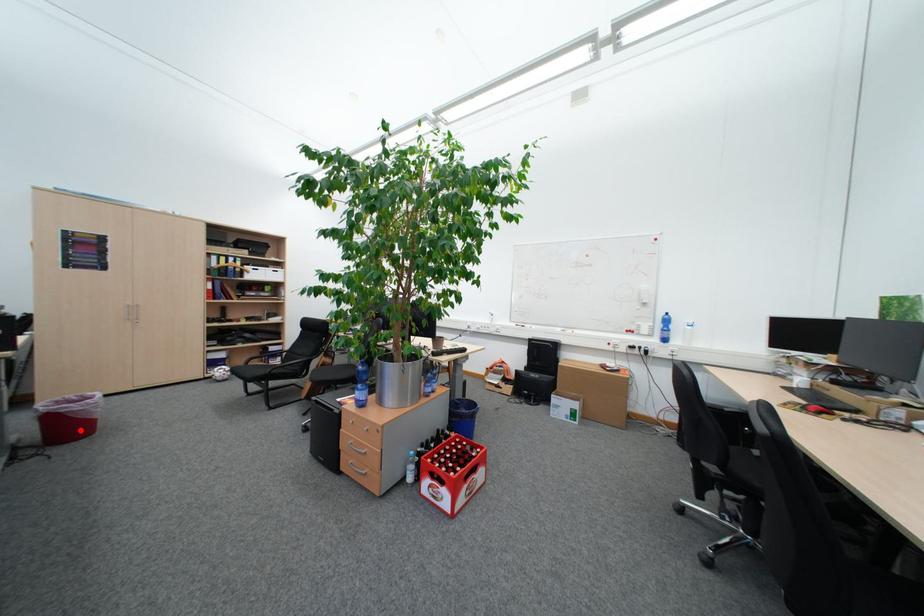
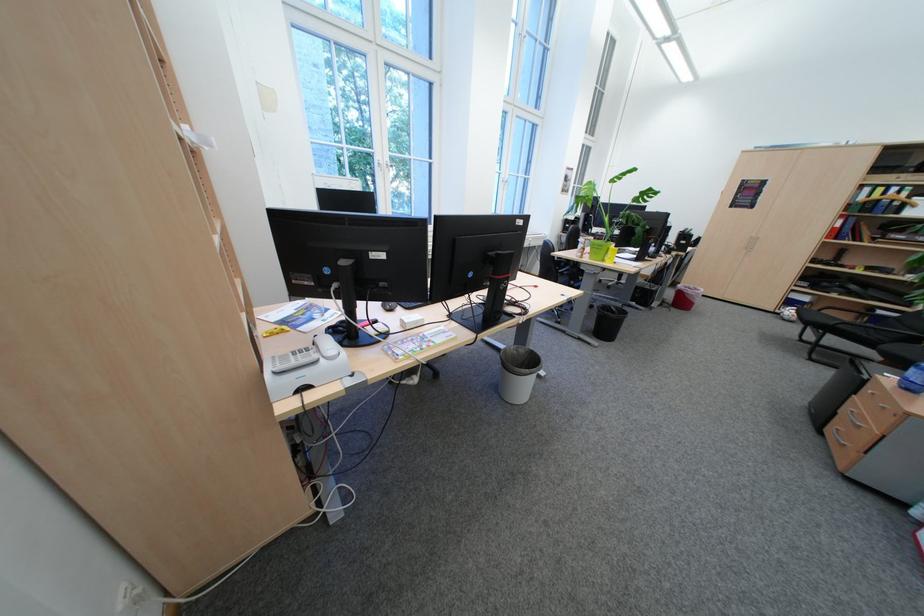
Question: I am providing you with two images of the same scene from different viewpoints. Given a red point in image1, look at the same physical point in image2. Is it:

Choices:
 (A) Closer to the viewpoint
 (B) Farther from the viewpoint

Answer: (A)